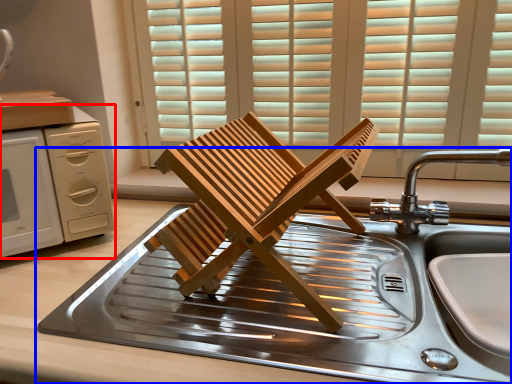
Question: Which object is further to the camera taking this photo, home appliance (highlighted by a red box) or sink (highlighted by a blue box)?

Choices:
 (A) home appliance
 (B) sink

Answer: (A)